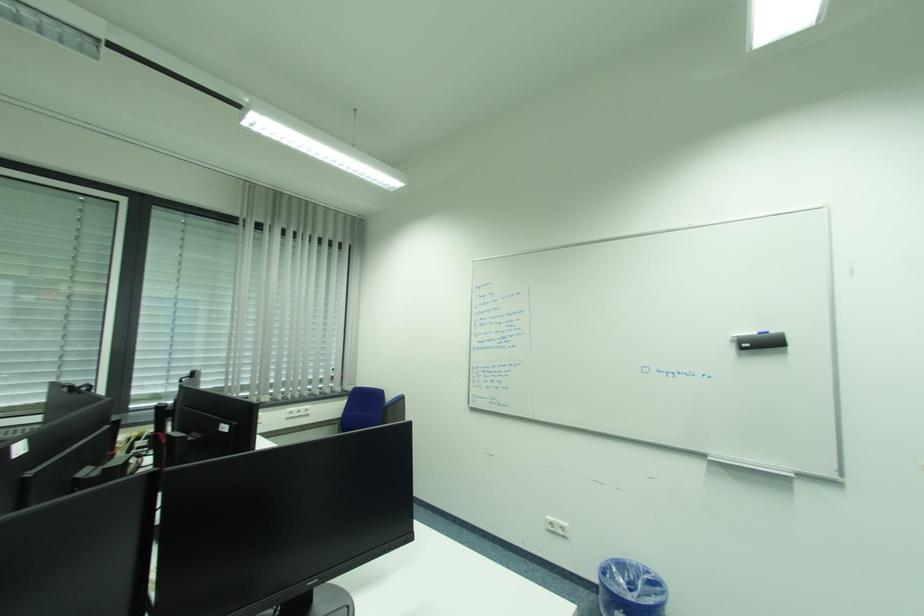
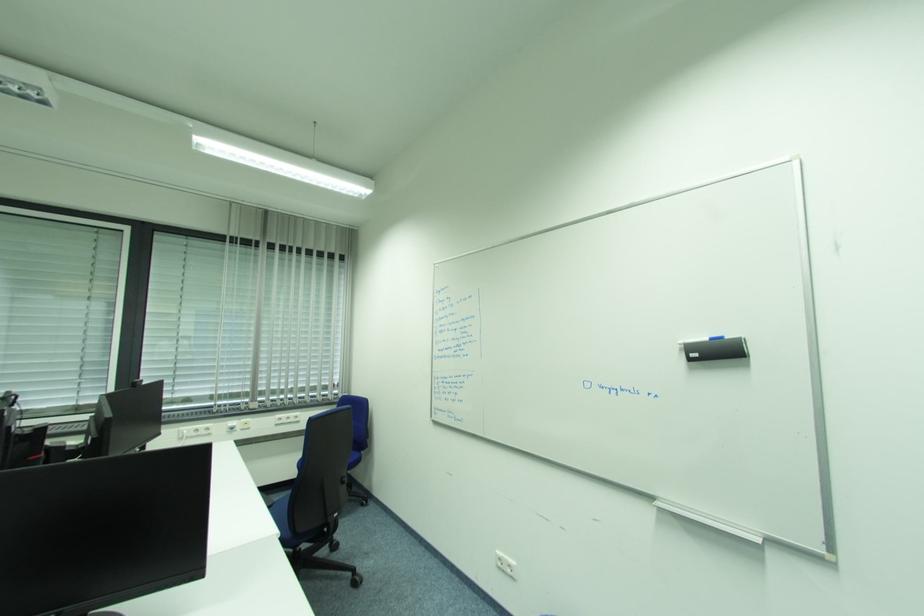
Question: In a continuous first-person perspective shot, in which direction is the camera moving?

Choices:
 (A) Left
 (B) Right
 (C) Forward
 (D) Backward

Answer: (B)